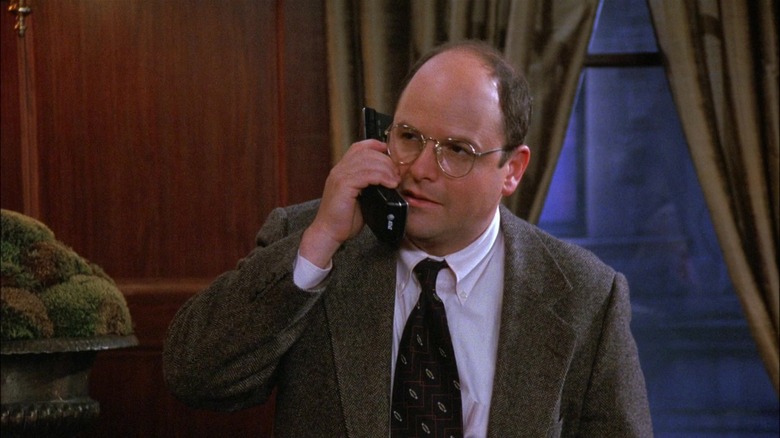
At what (x,y) coordinates should I click in order to perform the action: click on phone. Please return your answer as a coordinate pair (x, y). Looking at the image, I should click on (381, 213).